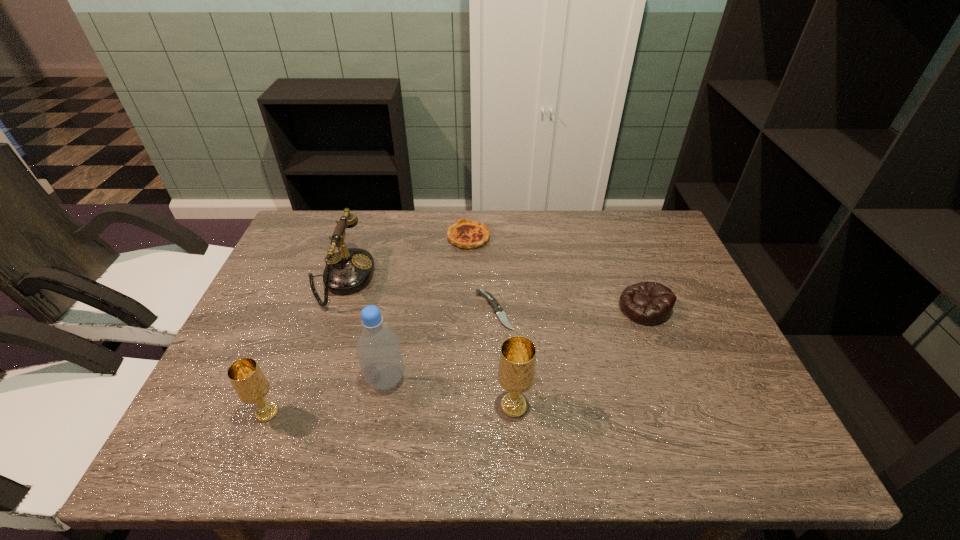
I want to click on vacant spot to place a chalice on the right, so click(x=755, y=399).